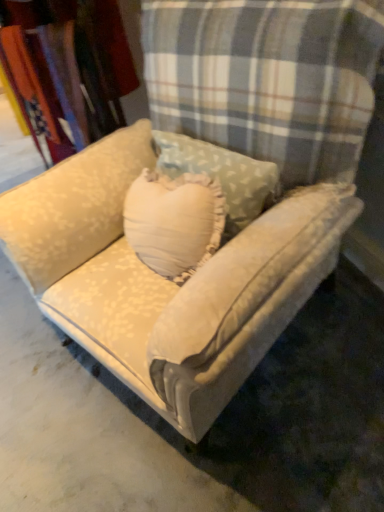
What do you see at coordinates (166, 279) in the screenshot? I see `velvet beige couch at center` at bounding box center [166, 279].

Locate an element on the screen. This screenshot has width=384, height=512. velvet beige couch at center is located at coordinates (166, 279).

I want to click on cream floral fabric at upper left, so click(x=79, y=62).

Describe the element at coordinates (79, 62) in the screenshot. This screenshot has height=512, width=384. I see `cream floral fabric at upper left` at that location.

Identify the location of velvet beige couch at center. (166, 279).

Based on the photo, would you say velvet beige couch at center is to the left or to the right of cream floral fabric at upper left in the picture?

From the image, it's evident that velvet beige couch at center is to the right of cream floral fabric at upper left.

Which object is further away from the camera taking this photo, velvet beige couch at center or cream floral fabric at upper left?

cream floral fabric at upper left is behind.

Considering the positions of points (282, 210) and (48, 56), is point (282, 210) farther from camera compared to point (48, 56)?

No, it is in front of (48, 56).

From the image's perspective, which is below, velvet beige couch at center or cream floral fabric at upper left?

velvet beige couch at center.

From a real-world perspective, is velvet beige couch at center physically above cream floral fabric at upper left?

No, from a real-world perspective, velvet beige couch at center is not over cream floral fabric at upper left

Which of these two, velvet beige couch at center or cream floral fabric at upper left, is wider?

With larger width is velvet beige couch at center.

Can you confirm if velvet beige couch at center is shorter than cream floral fabric at upper left?

No, velvet beige couch at center is not shorter than cream floral fabric at upper left.

Considering the relative sizes of velvet beige couch at center and cream floral fabric at upper left in the image provided, is velvet beige couch at center smaller than cream floral fabric at upper left?

No, velvet beige couch at center is not smaller than cream floral fabric at upper left.

Could cream floral fabric at upper left be considered to be inside velvet beige couch at center?

No, cream floral fabric at upper left is not surrounded by velvet beige couch at center.

Is there a large distance between velvet beige couch at center and cream floral fabric at upper left?

No, velvet beige couch at center is not far from cream floral fabric at upper left.

Is velvet beige couch at center aimed at cream floral fabric at upper left?

No, velvet beige couch at center is not turned towards cream floral fabric at upper left.

How many degrees apart are the facing directions of velvet beige couch at center and cream floral fabric at upper left?

The facing directions of velvet beige couch at center and cream floral fabric at upper left are 31.4 degrees apart.

Find the location of `studio couch below the cream floral fabric at upper left (from the image's perspective)`. studio couch below the cream floral fabric at upper left (from the image's perspective) is located at coordinates (166, 279).

Considering the positions of objects cream floral fabric at upper left and velvet beige couch at center in the image provided, who is more to the left, cream floral fabric at upper left or velvet beige couch at center?

cream floral fabric at upper left.

Consider the image. Which object is closer to the camera taking this photo, cream floral fabric at upper left or velvet beige couch at center?

velvet beige couch at center is closer to the camera.

Between point (106, 106) and point (284, 231), which one is positioned behind?

The point (106, 106) is farther from the camera.

From the image's perspective, is cream floral fabric at upper left located beneath velvet beige couch at center?

No.

From a real-world perspective, is cream floral fabric at upper left above or below velvet beige couch at center?

From a real-world perspective, cream floral fabric at upper left is physically above velvet beige couch at center.

Looking at this image, which object is thinner, cream floral fabric at upper left or velvet beige couch at center?

Thinner between the two is cream floral fabric at upper left.

Can you confirm if cream floral fabric at upper left is shorter than velvet beige couch at center?

Indeed, cream floral fabric at upper left has a lesser height compared to velvet beige couch at center.

In the scene shown: Is cream floral fabric at upper left bigger than velvet beige couch at center?

Incorrect, cream floral fabric at upper left is not larger than velvet beige couch at center.

Is velvet beige couch at center surrounded by cream floral fabric at upper left?

Actually, velvet beige couch at center is outside cream floral fabric at upper left.

Are cream floral fabric at upper left and velvet beige couch at center located far from each other?

They are positioned close to each other.

Is cream floral fabric at upper left positioned with its back to velvet beige couch at center?

No, velvet beige couch at center is not at the back of cream floral fabric at upper left.

Where is `fabric above the velvet beige couch at center (from a real-world perspective)`? The width and height of the screenshot is (384, 512). fabric above the velvet beige couch at center (from a real-world perspective) is located at coordinates pyautogui.click(x=79, y=62).

Locate an element on the screen. studio couch beneath the cream floral fabric at upper left (from a real-world perspective) is located at coordinates (166, 279).

Image resolution: width=384 pixels, height=512 pixels. Find the location of `studio couch on the right side of cream floral fabric at upper left`. studio couch on the right side of cream floral fabric at upper left is located at coordinates (166, 279).